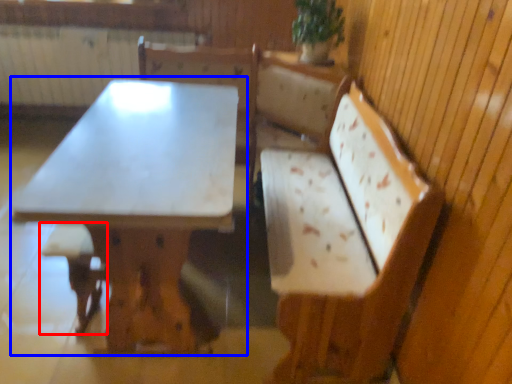
Question: Which of the following is the farthest to the observer, step stool (highlighted by a red box) or table (highlighted by a blue box)?

Choices:
 (A) step stool
 (B) table

Answer: (A)